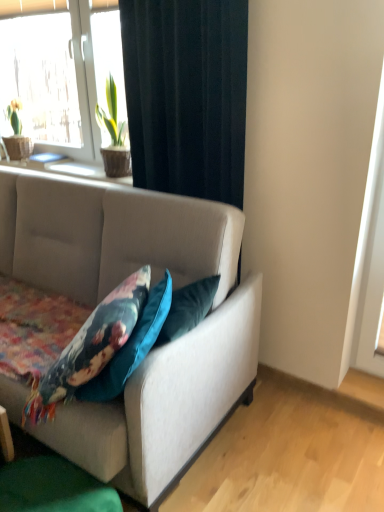
What is the approximate height of smooth wooden window sill at upper left?

smooth wooden window sill at upper left is 6.26 centimeters tall.

What do you see at coordinates (90, 346) in the screenshot?
I see `floral fabric cushion at lower left` at bounding box center [90, 346].

What are the coordinates of `textured beige studio couch at center` in the screenshot? It's located at (154, 350).

The height and width of the screenshot is (512, 384). I want to click on black fabric curtain at upper center, so click(187, 95).

You are a GUI agent. You are given a task and a screenshot of the screen. Output one action in this format:
    pyautogui.click(x=<x>, y=<y>)
    Task: Click on the white plastic window at upper left
    This screenshot has height=512, width=384.
    Given the screenshot: What is the action you would take?
    pyautogui.click(x=55, y=72)

From the picture: What's the angular difference between black fabric curtain at upper center and smooth wooden window sill at upper left's facing directions?

There is a 0.874-degree angle between the facing directions of black fabric curtain at upper center and smooth wooden window sill at upper left.

Looking at the image, does black fabric curtain at upper center seem bigger or smaller compared to smooth wooden window sill at upper left?

In the image, black fabric curtain at upper center appears to be larger than smooth wooden window sill at upper left.

Can you confirm if black fabric curtain at upper center is positioned to the left of smooth wooden window sill at upper left?

Incorrect, black fabric curtain at upper center is not on the left side of smooth wooden window sill at upper left.

Can we say textured beige studio couch at center lies outside smooth wooden window sill at upper left?

textured beige studio couch at center is positioned outside smooth wooden window sill at upper left.

Between textured beige studio couch at center and smooth wooden window sill at upper left, which one has more height?

textured beige studio couch at center.

Is textured beige studio couch at center positioned far away from smooth wooden window sill at upper left?

textured beige studio couch at center is near smooth wooden window sill at upper left, not far away.

From the image's perspective, which one is positioned lower, textured beige studio couch at center or smooth wooden window sill at upper left?

textured beige studio couch at center, from the image's perspective.

Is the surface of smooth wooden window sill at upper left in direct contact with black fabric curtain at upper center?

No, smooth wooden window sill at upper left is not touching black fabric curtain at upper center.

Could you tell me if smooth wooden window sill at upper left is facing black fabric curtain at upper center?

No, smooth wooden window sill at upper left is not aimed at black fabric curtain at upper center.

Is black fabric curtain at upper center completely or partially inside smooth wooden window sill at upper left?

No, black fabric curtain at upper center is not surrounded by smooth wooden window sill at upper left.

From the image's perspective, is smooth wooden window sill at upper left above black fabric curtain at upper center?

Yes, from the image's perspective, smooth wooden window sill at upper left is on top of black fabric curtain at upper center.

Which is behind, point (74, 166) or point (173, 436)?

The point (74, 166) is farther from the camera.

Is smooth wooden window sill at upper left facing away from textured beige studio couch at center?

No, smooth wooden window sill at upper left is not facing the opposite direction of textured beige studio couch at center.

Which is more to the right, smooth wooden window sill at upper left or textured beige studio couch at center?

textured beige studio couch at center is more to the right.

This screenshot has height=512, width=384. I want to click on window sill positioned vertically above the textured beige studio couch at center (from a real-world perspective), so click(x=67, y=168).

From a real-world perspective, is floral fabric cushion at lower left physically located above or below smooth wooden window sill at upper left?

Clearly, from a real-world perspective, floral fabric cushion at lower left is below smooth wooden window sill at upper left.

Do you think floral fabric cushion at lower left is within smooth wooden window sill at upper left, or outside of it?

floral fabric cushion at lower left cannot be found inside smooth wooden window sill at upper left.

Can you confirm if floral fabric cushion at lower left is positioned to the left of smooth wooden window sill at upper left?

Incorrect, floral fabric cushion at lower left is not on the left side of smooth wooden window sill at upper left.

From a real-world perspective, which is physically below, black fabric curtain at upper center or floral fabric cushion at lower left?

From a 3D spatial view, floral fabric cushion at lower left is below.

From the picture: Which object is closer to the camera, black fabric curtain at upper center or floral fabric cushion at lower left?

Positioned in front is floral fabric cushion at lower left.

Does white plastic window at upper left have a greater width compared to black fabric curtain at upper center?

Indeed, white plastic window at upper left has a greater width compared to black fabric curtain at upper center.

Is white plastic window at upper left oriented towards black fabric curtain at upper center?

No.

Considering the positions of points (78, 56) and (244, 128), is point (78, 56) farther from camera compared to point (244, 128)?

Yes.

Locate an element on the screen. curtain in front of the smooth wooden window sill at upper left is located at coordinates (187, 95).

The width and height of the screenshot is (384, 512). In order to click on studio couch below the smooth wooden window sill at upper left (from a real-world perspective) in this screenshot , I will do pyautogui.click(x=154, y=350).

From the image, which object appears to be farther from white plastic window at upper left, black fabric curtain at upper center or textured beige studio couch at center?

The object further to white plastic window at upper left is textured beige studio couch at center.

Based on their spatial positions, is textured beige studio couch at center or black fabric curtain at upper center closer to white plastic window at upper left?

The object closer to white plastic window at upper left is black fabric curtain at upper center.

Based on their spatial positions, is smooth wooden window sill at upper left or floral fabric cushion at lower left further from black fabric curtain at upper center?

The object further to black fabric curtain at upper center is floral fabric cushion at lower left.

Looking at the image, which one is located closer to floral fabric cushion at lower left, smooth wooden window sill at upper left or black fabric curtain at upper center?

black fabric curtain at upper center.

Considering their positions, is floral fabric cushion at lower left positioned further to white plastic window at upper left than smooth wooden window sill at upper left?

floral fabric cushion at lower left is positioned further to the anchor white plastic window at upper left.

Based on their spatial positions, is floral fabric cushion at lower left or black fabric curtain at upper center further from white plastic window at upper left?

The object further to white plastic window at upper left is floral fabric cushion at lower left.

Considering their positions, is black fabric curtain at upper center positioned further to textured beige studio couch at center than floral fabric cushion at lower left?

black fabric curtain at upper center.

Looking at the image, which one is located further to black fabric curtain at upper center, smooth wooden window sill at upper left or white plastic window at upper left?

white plastic window at upper left.

Identify the location of studio couch that lies between white plastic window at upper left and floral fabric cushion at lower left from top to bottom. (154, 350).

The width and height of the screenshot is (384, 512). What are the coordinates of `curtain between textured beige studio couch at center and smooth wooden window sill at upper left in the front-back direction` in the screenshot? It's located at (187, 95).

This screenshot has height=512, width=384. I want to click on curtain between white plastic window at upper left and floral fabric cushion at lower left vertically, so click(187, 95).

What are the coordinates of `window positioned between textured beige studio couch at center and smooth wooden window sill at upper left from near to far` in the screenshot? It's located at (55, 72).